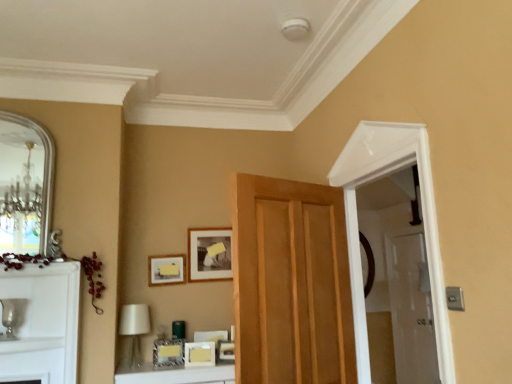
Question: Is matte black picture frame at upper center, positioned as the 1th picture frame in back-to-front order, aimed at silver metallic mirror at left?

Choices:
 (A) yes
 (B) no

Answer: (B)

Question: Is matte black picture frame at upper center, acting as the 5th picture frame starting from the front, thinner than silver metallic mirror at left?

Choices:
 (A) yes
 (B) no

Answer: (A)

Question: Would you consider matte black picture frame at upper center, positioned as the 1th picture frame in back-to-front order, to be distant from silver metallic mirror at left?

Choices:
 (A) no
 (B) yes

Answer: (B)

Question: Is matte black picture frame at upper center, acting as the 5th picture frame starting from the front, smaller than silver metallic mirror at left?

Choices:
 (A) yes
 (B) no

Answer: (A)

Question: Considering the relative positions of matte black picture frame at upper center, positioned as the 1th picture frame in back-to-front order, and silver metallic mirror at left in the image provided, is matte black picture frame at upper center, positioned as the 1th picture frame in back-to-front order, in front of silver metallic mirror at left?

Choices:
 (A) no
 (B) yes

Answer: (A)

Question: From a real-world perspective, is matte gold picture frame at center, the 2th picture frame from the front, above or below clear glass door at right?

Choices:
 (A) below
 (B) above

Answer: (B)

Question: Is matte gold picture frame at center, the 2th picture frame from the front, taller or shorter than clear glass door at right?

Choices:
 (A) short
 (B) tall

Answer: (A)

Question: Visually, is matte gold picture frame at center, the 2th picture frame from the front, positioned to the left or to the right of clear glass door at right?

Choices:
 (A) left
 (B) right

Answer: (A)

Question: From the image's perspective, is matte gold picture frame at center, the 4th picture frame positioned from the back, located above or below clear glass door at right?

Choices:
 (A) above
 (B) below

Answer: (A)

Question: Is point (180, 256) closer or farther from the camera than point (234, 327)?

Choices:
 (A) closer
 (B) farther

Answer: (B)

Question: From the image's perspective, is matte gold picture frame at upper center, marked as the second picture frame in a back-to-front arrangement, above or below wooden door at center?

Choices:
 (A) below
 (B) above

Answer: (A)

Question: Considering the relative positions of matte gold picture frame at upper center, which is the 4th picture frame from front to back, and wooden door at center in the image provided, is matte gold picture frame at upper center, which is the 4th picture frame from front to back, to the left or to the right of wooden door at center?

Choices:
 (A) right
 (B) left

Answer: (B)

Question: From their relative heights in the image, would you say matte gold picture frame at upper center, which is the 4th picture frame from front to back, is taller or shorter than wooden door at center?

Choices:
 (A) tall
 (B) short

Answer: (B)

Question: Looking at the image, does wooden door at center seem bigger or smaller compared to matte gold picture frame at center, the 4th picture frame positioned from the back?

Choices:
 (A) big
 (B) small

Answer: (A)

Question: Would you say wooden door at center is to the left or to the right of matte gold picture frame at center, the 2th picture frame from the front, in the picture?

Choices:
 (A) right
 (B) left

Answer: (A)